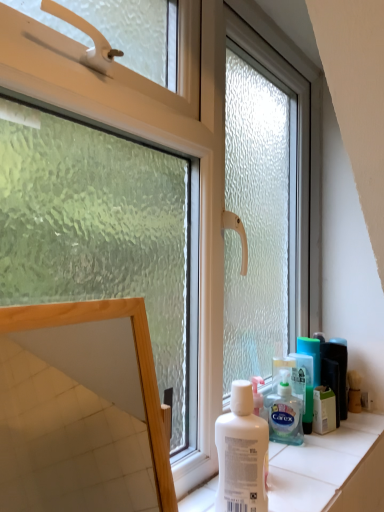
Image resolution: width=384 pixels, height=512 pixels. Identify the location of white matte bottle at center. (242, 454).

Which object is thinner, wooden frame mirror at lower left or white matte bottle at center?

With smaller width is wooden frame mirror at lower left.

Who is taller, wooden frame mirror at lower left or white matte bottle at center?

wooden frame mirror at lower left is taller.

Is wooden frame mirror at lower left facing towards white matte bottle at center?

No, wooden frame mirror at lower left does not turn towards white matte bottle at center.

Is wooden frame mirror at lower left not close to white matte bottle at center?

Absolutely, wooden frame mirror at lower left is distant from white matte bottle at center.

Considering the relative sizes of translucent plastic shaving cream at lower right and green plastic mouthwash at right in the image provided, is translucent plastic shaving cream at lower right shorter than green plastic mouthwash at right?

Indeed, translucent plastic shaving cream at lower right has a lesser height compared to green plastic mouthwash at right.

Is translucent plastic shaving cream at lower right smaller than green plastic mouthwash at right?

No.

Is translucent plastic shaving cream at lower right positioned behind green plastic mouthwash at right?

No, translucent plastic shaving cream at lower right is closer to the camera.

From the image's perspective, is translucent plastic shaving cream at lower right located above or below green plastic mouthwash at right?

Clearly, from the image's perspective, translucent plastic shaving cream at lower right is below green plastic mouthwash at right.

At what (x,y) coordinates should I click in order to perform the action: click on product below the wooden frame mirror at lower left (from a real-world perspective). Please return your answer as a coordinate pair (x, y). The image size is (384, 512). Looking at the image, I should click on (324, 410).

From the image's perspective, which is below, wooden frame mirror at lower left or white plastic box at right?

white plastic box at right, from the image's perspective.

In terms of height, does wooden frame mirror at lower left look taller or shorter compared to white plastic box at right?

wooden frame mirror at lower left is taller than white plastic box at right.

Based on the photo, considering the positions of objects wooden frame mirror at lower left and white plastic box at right in the image provided, who is more to the left, wooden frame mirror at lower left or white plastic box at right?

Positioned to the left is wooden frame mirror at lower left.

From the image's perspective, does green plastic mouthwash at right appear higher than white plastic box at right?

Indeed, from the image's perspective, green plastic mouthwash at right is shown above white plastic box at right.

Is green plastic mouthwash at right positioned beyond the bounds of white plastic box at right?

That's correct, green plastic mouthwash at right is outside of white plastic box at right.

Consider the image. Which of these two, green plastic mouthwash at right or white plastic box at right, is thinner?

With smaller width is white plastic box at right.

Which is closer, (306, 401) or (22, 504)?

Clearly, point (306, 401) is closer to the camera than point (22, 504).

Is green plastic mouthwash at right looking in the opposite direction of wooden frame mirror at lower left?

No, green plastic mouthwash at right is not facing the opposite direction of wooden frame mirror at lower left.

From a real-world perspective, which is physically below, green plastic mouthwash at right or wooden frame mirror at lower left?

green plastic mouthwash at right.

From the image's perspective, relative to white matte bottle at center, is translucent plastic shaving cream at lower right above or below?

translucent plastic shaving cream at lower right is below white matte bottle at center.

From a real-world perspective, is translucent plastic shaving cream at lower right physically located above or below white matte bottle at center?

translucent plastic shaving cream at lower right is situated lower than white matte bottle at center in the real world.

Which of these two, translucent plastic shaving cream at lower right or white matte bottle at center, is bigger?

With larger size is white matte bottle at center.

Is translucent plastic shaving cream at lower right outside of white matte bottle at center?

Absolutely, translucent plastic shaving cream at lower right is external to white matte bottle at center.

At what (x,y) coordinates should I click in order to perform the action: click on bottle above the green plastic mouthwash at right (from a real-world perspective). Please return your answer as a coordinate pair (x, y). The width and height of the screenshot is (384, 512). Looking at the image, I should click on (242, 454).

From a real-world perspective, between white matte bottle at center and green plastic mouthwash at right, who is vertically higher?

white matte bottle at center is physically above.

Is white matte bottle at center not inside green plastic mouthwash at right?

Yes.

You are a GUI agent. You are given a task and a screenshot of the screen. Output one action in this format:
    pyautogui.click(x=<x>, y=<y>)
    Task: Click on the mirror located on the left of white matte bottle at center
    This screenshot has height=512, width=384.
    Given the screenshot: What is the action you would take?
    pyautogui.click(x=81, y=410)

I want to click on shaving cream below the green plastic mouthwash at right (from the image's perspective), so click(x=284, y=411).

Estimate the real-world distances between objects in this image. Which object is further from white plastic box at right, translucent plastic shaving cream at lower right or green plastic mouthwash at right?

Among the two, translucent plastic shaving cream at lower right is located further to white plastic box at right.

From the image, which object appears to be nearer to green plastic mouthwash at right, white matte bottle at center or wooden frame mirror at lower left?

The object closer to green plastic mouthwash at right is white matte bottle at center.

From the image, which object appears to be farther from white plastic box at right, white matte bottle at center or green plastic mouthwash at right?

Among the two, white matte bottle at center is located further to white plastic box at right.

Based on their spatial positions, is translucent plastic shaving cream at lower right or white matte bottle at center further from white plastic box at right?

white matte bottle at center.

When comparing their distances from wooden frame mirror at lower left, does white plastic box at right or translucent plastic shaving cream at lower right seem further?

white plastic box at right.

From the image, which object appears to be nearer to wooden frame mirror at lower left, green plastic mouthwash at right or white matte bottle at center?

Among the two, green plastic mouthwash at right is located nearer to wooden frame mirror at lower left.

From the image, which object appears to be nearer to white matte bottle at center, wooden frame mirror at lower left or translucent plastic shaving cream at lower right?

translucent plastic shaving cream at lower right is positioned closer to the anchor white matte bottle at center.

In the scene shown: From the image, which object appears to be nearer to white matte bottle at center, white plastic box at right or translucent plastic shaving cream at lower right?

translucent plastic shaving cream at lower right lies closer to white matte bottle at center than the other object.

At what (x,y) coordinates should I click in order to perform the action: click on shaving cream between white matte bottle at center and green plastic mouthwash at right along the z-axis. Please return your answer as a coordinate pair (x, y). The image size is (384, 512). Looking at the image, I should click on (284, 411).

Locate an element on the screen. The width and height of the screenshot is (384, 512). shaving cream positioned between wooden frame mirror at lower left and white plastic box at right from near to far is located at coordinates (x=284, y=411).

Identify the location of bottle between wooden frame mirror at lower left and white plastic box at right along the z-axis. tap(242, 454).

The width and height of the screenshot is (384, 512). I want to click on product located between white matte bottle at center and green plastic mouthwash at right in the depth direction, so click(324, 410).